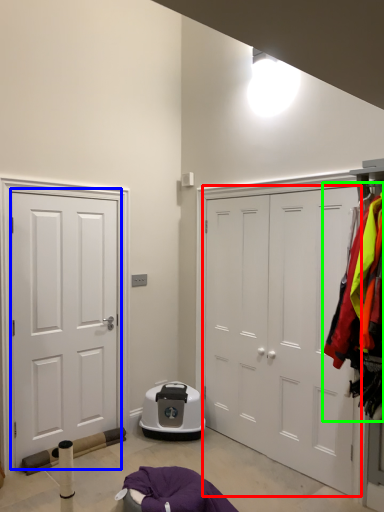
Question: Which is nearer to the door (highlighted by a red box)? door (highlighted by a blue box) or laundry (highlighted by a green box).

Choices:
 (A) door
 (B) laundry

Answer: (B)